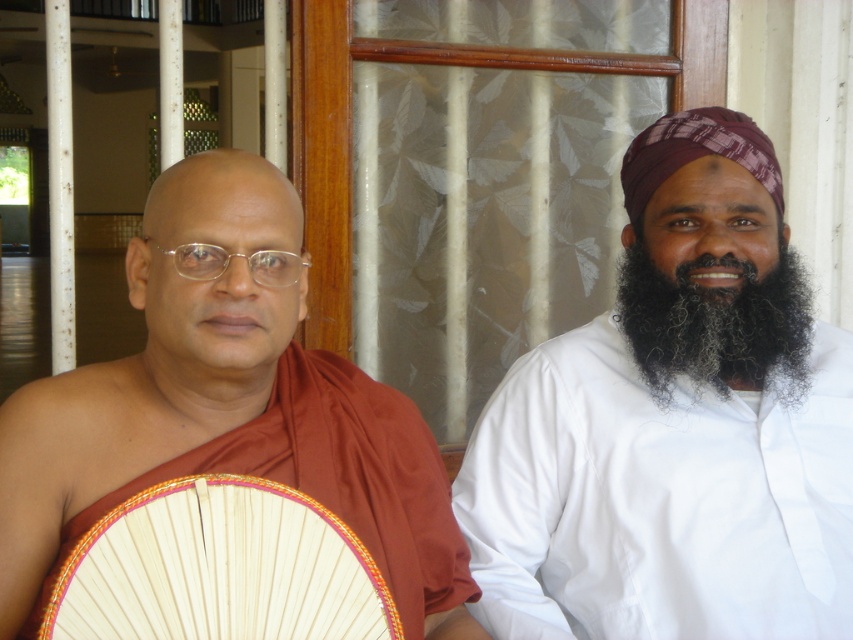
Question: Which object is closer to the camera taking this photo?

Choices:
 (A) matte orange robe at left
 (B) white cotton shirt at right

Answer: (A)

Question: Among these objects, which one is nearest to the camera?

Choices:
 (A) matte orange robe at left
 (B) black curly beard at right
 (C) white cotton shirt at right

Answer: (A)

Question: Is white cotton shirt at right further to the viewer compared to matte orange robe at left?

Choices:
 (A) yes
 (B) no

Answer: (A)

Question: Where is white cotton shirt at right located in relation to black curly beard at right in the image?

Choices:
 (A) above
 (B) below

Answer: (B)

Question: Which point is closer to the camera taking this photo?

Choices:
 (A) (737, 320)
 (B) (730, 580)

Answer: (B)

Question: Does matte orange robe at left have a smaller size compared to black curly beard at right?

Choices:
 (A) yes
 (B) no

Answer: (B)